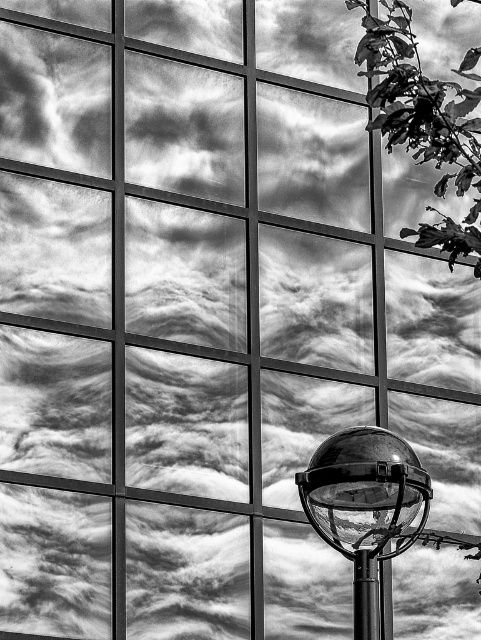
You are an architect designing a new public space and want to ensure that the polished glass globe at center and the polished metal pole at lower right are positioned so that they do not block each other. Based on their sizes, which object should be placed closer to the entrance to avoid obstruction?

The polished glass globe at center might be wider than polished metal pole at lower right, so to avoid obstruction, the wider polished glass globe at center should be placed closer to the entrance.